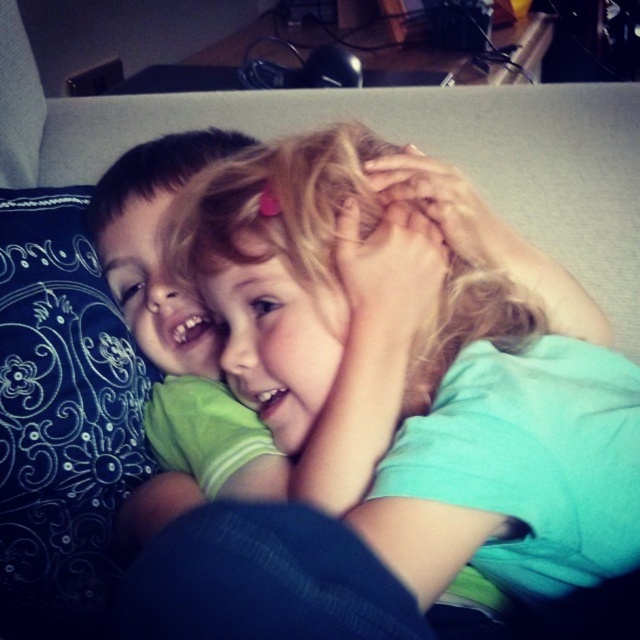
Looking at the two children on the couch, you notice the blonde hair at center and the dark blue fabric at center. Which one of these two items is larger in size?

The blonde hair at center is bigger than the dark blue fabric at center.

You are a photographer setting up a shot of two children on a couch. You need to place a small prop between the blue embroidered pillow at left and the dark blue fabric at center. Based on their positions, where should you place the prop to ensure it is between them?

The blue embroidered pillow at left is on the left side of the dark blue fabric at center, so place the prop to the right of the blue embroidered pillow at left but to the left of the dark blue fabric at center to position it between them.

You are a photographer trying to capture the children in the image. You want to place a small prop at the exact location of the point labeled as point (x=61, y=419). Based on the scene description, where should you place the prop relative to the blue embroidered pillow at left?

The point (x=61, y=419) is located on the blue embroidered pillow at left, so you should place the prop directly on top of the blue embroidered pillow at left.